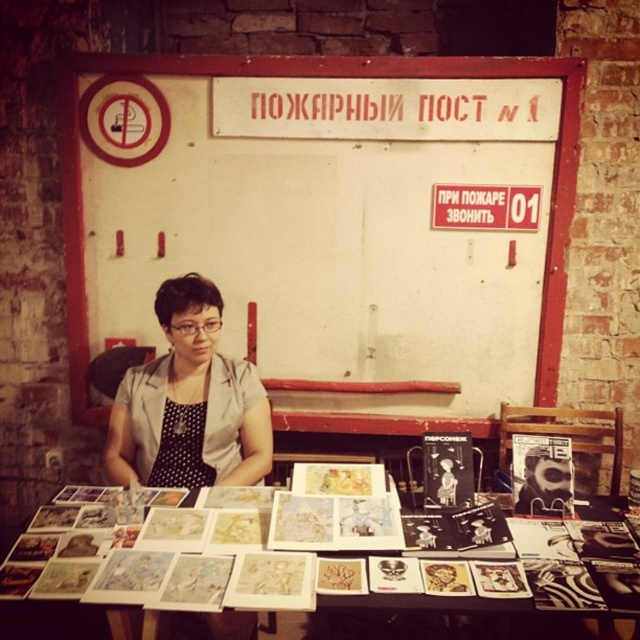
You are an artist who needs to choose between the white paper at center and the black dotted fabric apron at center to display a new artwork. Which item has a larger width according to the scene?

The white paper at center has a larger width than the black dotted fabric apron at center.